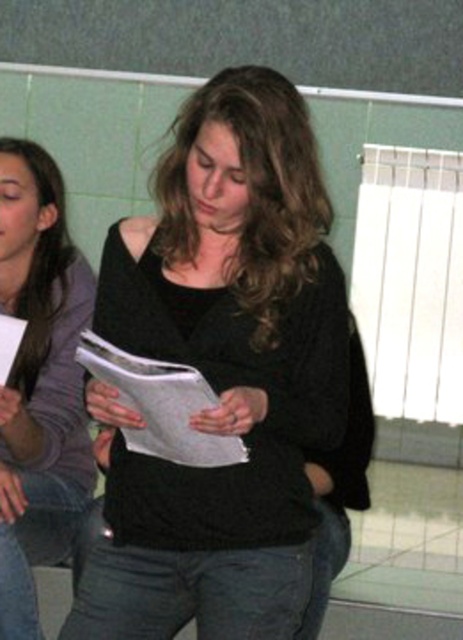
This screenshot has height=640, width=463. What do you see at coordinates (221, 372) in the screenshot?
I see `black matte sweater at center` at bounding box center [221, 372].

Can you confirm if black matte sweater at center is shorter than white paper at center?

Incorrect, black matte sweater at center's height does not fall short of white paper at center's.

The image size is (463, 640). Identify the location of black matte sweater at center. (221, 372).

Image resolution: width=463 pixels, height=640 pixels. Find the location of `black matte sweater at center`. black matte sweater at center is located at coordinates (221, 372).

How much distance is there between matte black sweater at center and white paper at center?

The distance of matte black sweater at center from white paper at center is 29.89 inches.

Does matte black sweater at center appear over white paper at center?

Indeed, matte black sweater at center is positioned over white paper at center.

This screenshot has height=640, width=463. I want to click on matte black sweater at center, so click(x=38, y=369).

Identify the location of matte black sweater at center. This screenshot has height=640, width=463. (38, 369).

Between black matte sweater at center and matte black sweater at center, which one has more height?

With more height is matte black sweater at center.

Can you confirm if black matte sweater at center is bigger than matte black sweater at center?

Incorrect, black matte sweater at center is not larger than matte black sweater at center.

What do you see at coordinates (221, 372) in the screenshot? I see `black matte sweater at center` at bounding box center [221, 372].

The height and width of the screenshot is (640, 463). I want to click on black matte sweater at center, so click(221, 372).